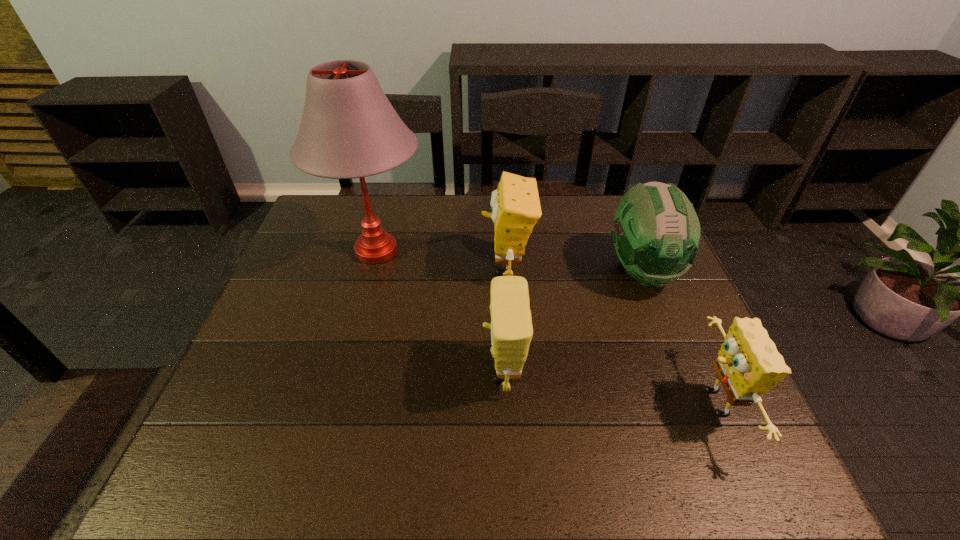
Where is `the tallest object`? the tallest object is located at coordinates (349, 129).

The width and height of the screenshot is (960, 540). In order to click on table lamp in this screenshot , I will do `click(349, 129)`.

The width and height of the screenshot is (960, 540). I want to click on the farthest sponge, so click(x=515, y=206).

Identify the location of football helmet. (656, 233).

At what (x,y) coordinates should I click in order to perform the action: click on the rightmost sponge. Please return your answer as a coordinate pair (x, y). This screenshot has height=540, width=960. Looking at the image, I should click on (748, 365).

This screenshot has width=960, height=540. Identify the location of vacant space located on the front-facing side of the leftmost object. (515, 251).

This screenshot has height=540, width=960. I want to click on blank area located 0.170m on the face of the farthest sponge, so click(x=422, y=265).

Find the location of `vacant space situated on the face of the farthest sponge`. vacant space situated on the face of the farthest sponge is located at coordinates (392, 265).

The image size is (960, 540). Find the location of `vacant space situated on the face of the farthest sponge`. vacant space situated on the face of the farthest sponge is located at coordinates (412, 265).

Where is `free space located on the visor of the football helmet`? free space located on the visor of the football helmet is located at coordinates (706, 431).